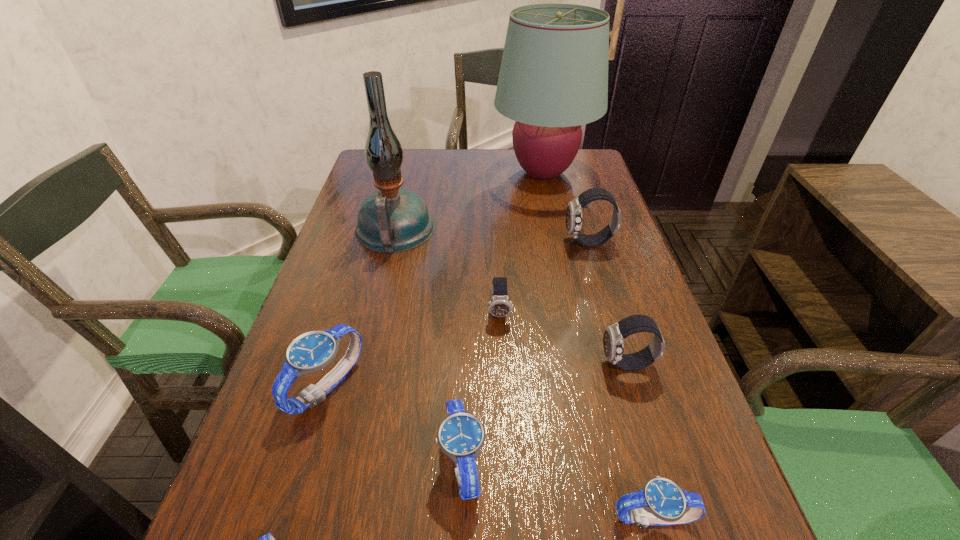
The width and height of the screenshot is (960, 540). I want to click on lampshade, so click(x=553, y=78).

You are a GUI agent. You are given a task and a screenshot of the screen. Output one action in this format:
    pyautogui.click(x=<x>, y=<y>)
    Task: Click on the blue lampshade
    
    Given the screenshot: What is the action you would take?
    [x=553, y=78]

Locate an element on the screen. oil lamp is located at coordinates (392, 220).

I want to click on the biggest dark watch, so click(574, 209).

Identify the location of the farthest dark watch. (574, 209).

This screenshot has height=540, width=960. Identify the location of the nearest dark watch. (614, 335).

Identify the location of the biggest blue watch. (313, 351).

Identify the location of the fifth watch from right to left. (461, 435).

Find the location of a particular element. the sixth object from right to left is located at coordinates (461, 435).

Identify the location of the second farthest dark watch. This screenshot has width=960, height=540. (499, 306).